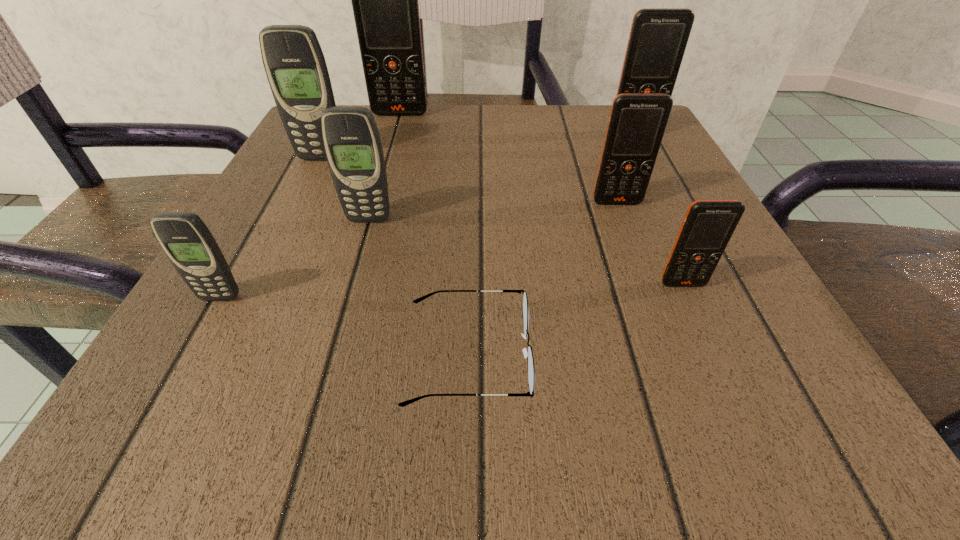
Identify the location of the tallest cellular telephone. (385, 4).

Locate an element on the screen. the farthest object is located at coordinates (385, 4).

Locate an element on the screen. the second biggest orange cellular telephone is located at coordinates (658, 37).

Identify the location of the second farthest cellular telephone. The image size is (960, 540). (658, 37).

Identify the location of the third farthest object. (294, 63).

Locate an element on the screen. The height and width of the screenshot is (540, 960). the biggest gray cellular telephone is located at coordinates (294, 63).

Locate an element on the screen. the second biggest gray cellular telephone is located at coordinates (351, 139).

Locate an element on the screen. the fifth farthest cellular telephone is located at coordinates (351, 139).

Identify the location of the fourth farthest object. (637, 123).

Where is `the third farthest orange cellular telephone`? the third farthest orange cellular telephone is located at coordinates (637, 123).